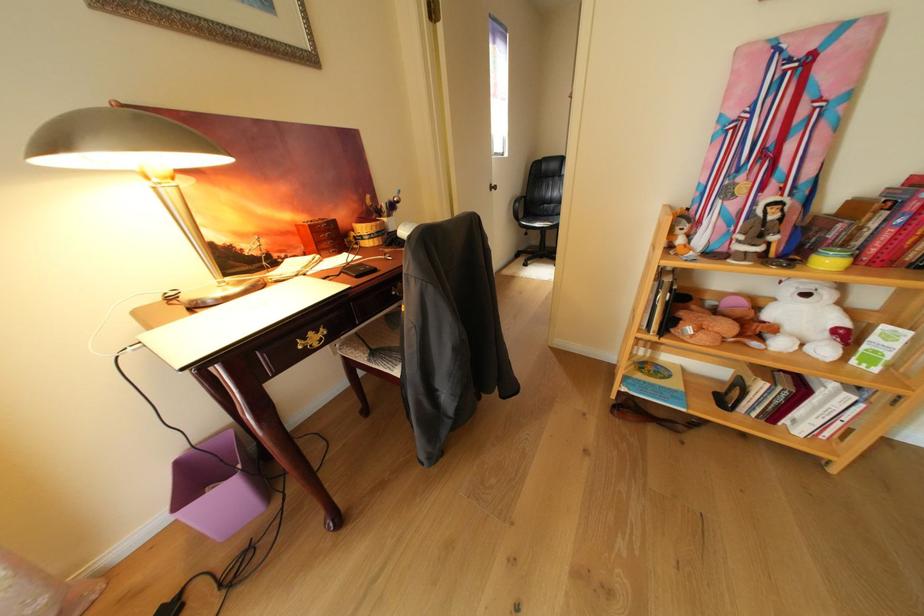
The image size is (924, 616). Find the location of `brass drawer handle`. brass drawer handle is located at coordinates (311, 339).